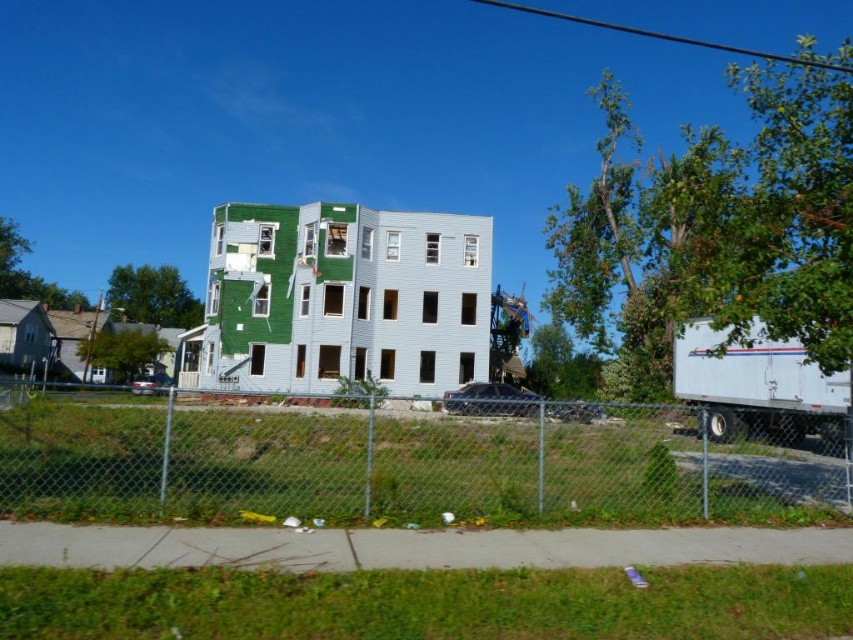
Does green matte building at center appear over white matte trailer truck at right?

Yes.

Can you confirm if green matte building at center is smaller than white matte trailer truck at right?

No, green matte building at center is not smaller than white matte trailer truck at right.

Is point (212, 224) positioned before point (733, 410)?

No, (212, 224) is further to viewer.

The height and width of the screenshot is (640, 853). Identify the location of green matte building at center. (341, 300).

Which is below, chain-link fence at center or white matte trailer truck at right?

chain-link fence at center is below.

Between point (212, 490) and point (759, 404), which one is positioned behind?

Positioned behind is point (759, 404).

Locate an element on the screen. The height and width of the screenshot is (640, 853). chain-link fence at center is located at coordinates (387, 461).

Does chain-link fence at center have a larger size compared to green matte building at center?

No, chain-link fence at center is not bigger than green matte building at center.

Image resolution: width=853 pixels, height=640 pixels. What are the coordinates of `chain-link fence at center` in the screenshot? It's located at (387, 461).

In order to click on chain-link fence at center in this screenshot , I will do `click(387, 461)`.

This screenshot has width=853, height=640. I want to click on chain-link fence at center, so click(387, 461).